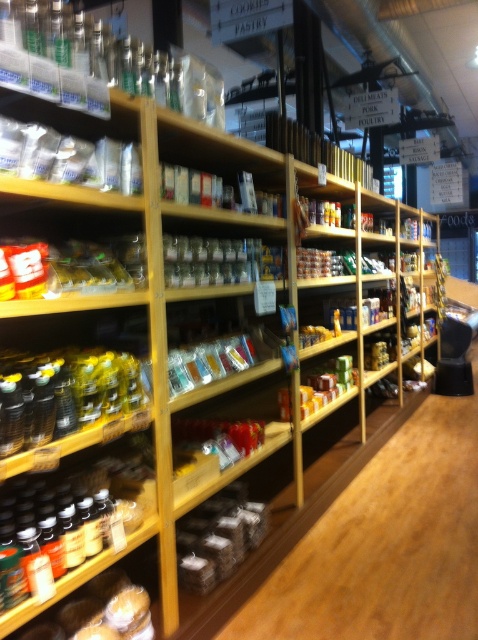
Question: Which object is positioned closest to the metallic foil packets at center?

Choices:
 (A) translucent plastic jars at upper left
 (B) brown matte bagels at lower center

Answer: (A)

Question: Which point is farther to the camera?

Choices:
 (A) (118, 269)
 (B) (194, 588)
 (C) (78, 116)
 (D) (278, 253)

Answer: (D)

Question: Can you confirm if translucent plastic bottles at lower left is positioned above metallic foil packets at center?

Choices:
 (A) yes
 (B) no

Answer: (B)

Question: Does translucent plastic jars at upper left have a smaller size compared to yellow matte honey jar at center?

Choices:
 (A) no
 (B) yes

Answer: (A)

Question: Which of the following is the closest to the observer?

Choices:
 (A) shiny plastic jar at center
 (B) brown matte bagels at lower center

Answer: (B)

Question: Can you confirm if translucent plastic spice at center is smaller than translucent plastic bottles at lower left?

Choices:
 (A) no
 (B) yes

Answer: (A)